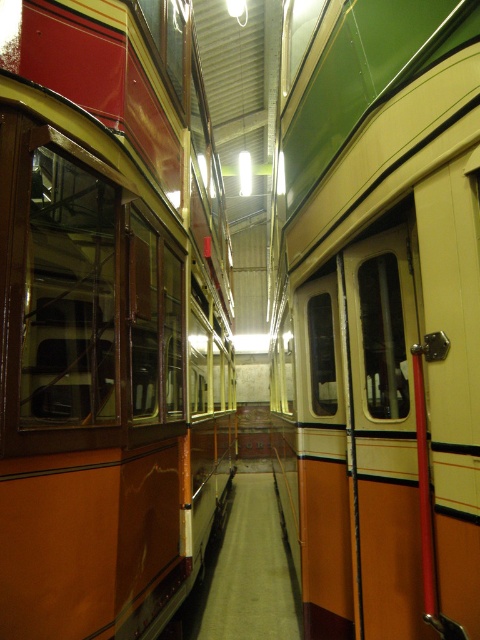
Is matte orange bus at left wider than matte orange door at center?

Indeed, matte orange bus at left has a greater width compared to matte orange door at center.

Locate an element on the screen. This screenshot has height=640, width=480. matte orange bus at left is located at coordinates (108, 317).

Which is behind, point (156, 64) or point (297, 342)?

Point (297, 342)

The width and height of the screenshot is (480, 640). Find the location of `matte orange bus at left`. matte orange bus at left is located at coordinates (108, 317).